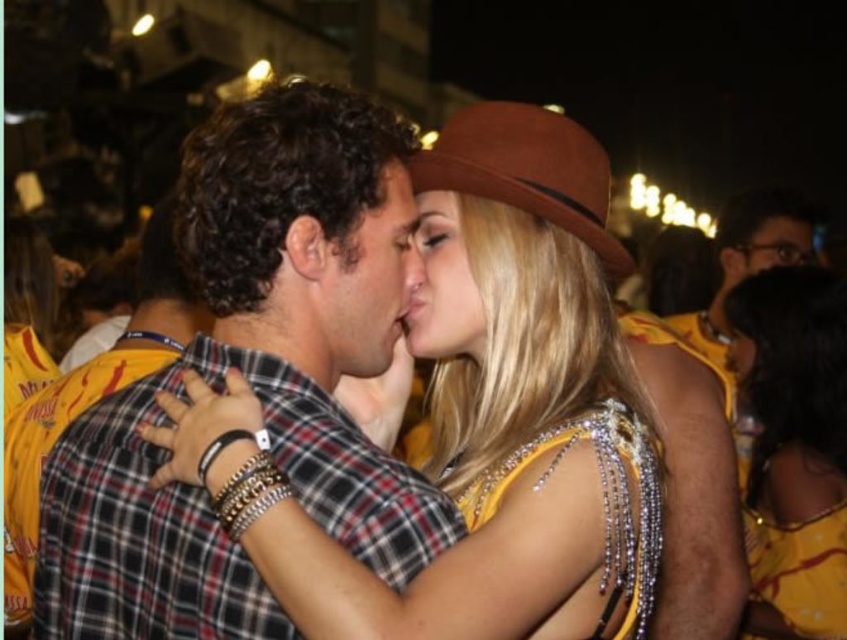
Question: Among these points, which one is farthest from the camera?

Choices:
 (A) (762, 221)
 (B) (452, 332)
 (C) (17, 596)
 (D) (403, 211)

Answer: (A)

Question: Does shiny gold dress at center lie behind yellow sequined dress at center?

Choices:
 (A) no
 (B) yes

Answer: (A)

Question: Where is shiny gold dress at center located in relation to matte brown hat at center in the image?

Choices:
 (A) left
 (B) right

Answer: (B)

Question: Considering the real-world distances, which object is farthest from the matte brown hat at center?

Choices:
 (A) plaid shirt at center
 (B) brown felt cowboy hat at upper center
 (C) plaid fabric shirt at center
 (D) matte black glasses at upper right

Answer: (D)

Question: Which object is farther from the camera taking this photo?

Choices:
 (A) plaid fabric shirt at center
 (B) matte brown hat at center

Answer: (B)

Question: Is shiny gold dress at center positioned in front of matte black glasses at upper right?

Choices:
 (A) yes
 (B) no

Answer: (A)